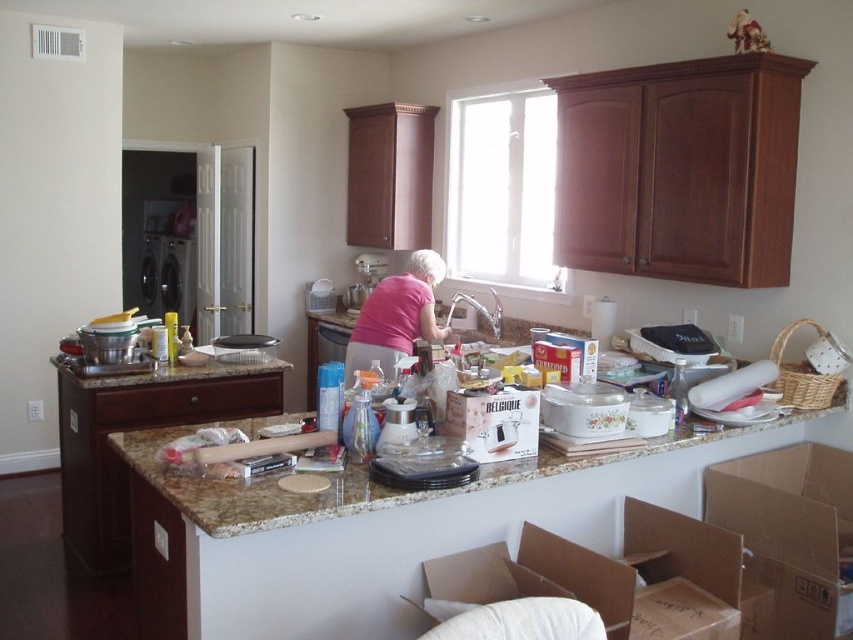
You are organizing the kitchen and need to move the brown cardboard box at lower right and the black plastic dishwasher at left. Which object should you move first if you want to reach the one behind them?

You should move the brown cardboard box at lower right first because it is closer to the viewer and blocking access to the black plastic dishwasher at left which is further back.

You need to place a large cutting board on either the granite countertop at center or the black plastic dishwasher at left. Which surface can accommodate it based on their widths?

The granite countertop at center is wider than the black plastic dishwasher at left, so it can accommodate the large cutting board.

From the picture: You are a delivery robot that is 2 feet wide. You are currently at the entrance of the kitchen and want to place a package on the granite countertop at center. Can you navigate to the countertop without moving any objects on it?

The granite countertop at center and camera are 5.46 feet apart from each other. Since the robot is 2 feet wide, it can navigate to the countertop as long as there is enough space between the entrance and the countertop. However, the question mentions objects scattered on the countertop, so the robot may need to adjust its path to avoid them, but the distance is sufficient.